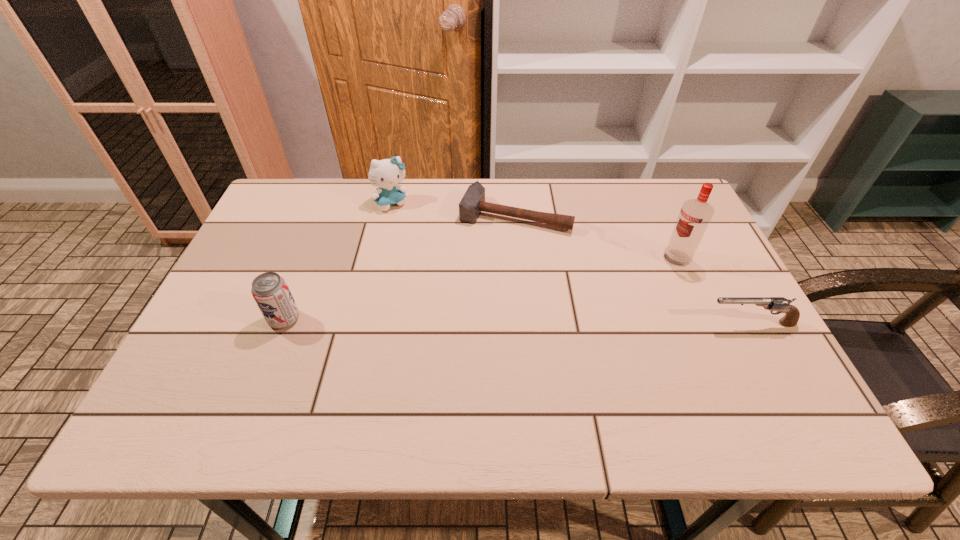
Identify the location of vacant space at the far right corner. The height and width of the screenshot is (540, 960). (662, 214).

This screenshot has height=540, width=960. Find the location of `vacant region at the near right corner of the desktop`. vacant region at the near right corner of the desktop is located at coordinates (715, 372).

You are a GUI agent. You are given a task and a screenshot of the screen. Output one action in this format:
    pyautogui.click(x=<x>, y=<y>)
    Task: Click on the free space that is in between the hammer and the second tallest object
    The image size is (960, 540).
    Given the screenshot: What is the action you would take?
    pyautogui.click(x=453, y=208)

The image size is (960, 540). I want to click on free spot between the kitten and the second shortest object, so click(571, 262).

Find the location of a particular element. This screenshot has height=540, width=960. free space between the tallest object and the leftmost object is located at coordinates (481, 289).

Find the location of a particular element. vacant point located between the shortest object and the beer can is located at coordinates (399, 267).

In order to click on unoccupied area between the third object from right to left and the gun in this screenshot , I will do `click(633, 269)`.

Locate an element on the screen. This screenshot has width=960, height=540. vacant space that's between the third object from right to left and the third nearest object is located at coordinates [596, 237].

Where is `free space that is in between the fourth object from right to left and the fourth tallest object`? This screenshot has height=540, width=960. free space that is in between the fourth object from right to left and the fourth tallest object is located at coordinates (571, 262).

You are a GUI agent. You are given a task and a screenshot of the screen. Output one action in this format:
    pyautogui.click(x=<x>, y=<y>)
    Task: Click on the free space between the third farthest object and the hammer
    This screenshot has height=540, width=960.
    Given the screenshot: What is the action you would take?
    pyautogui.click(x=596, y=237)